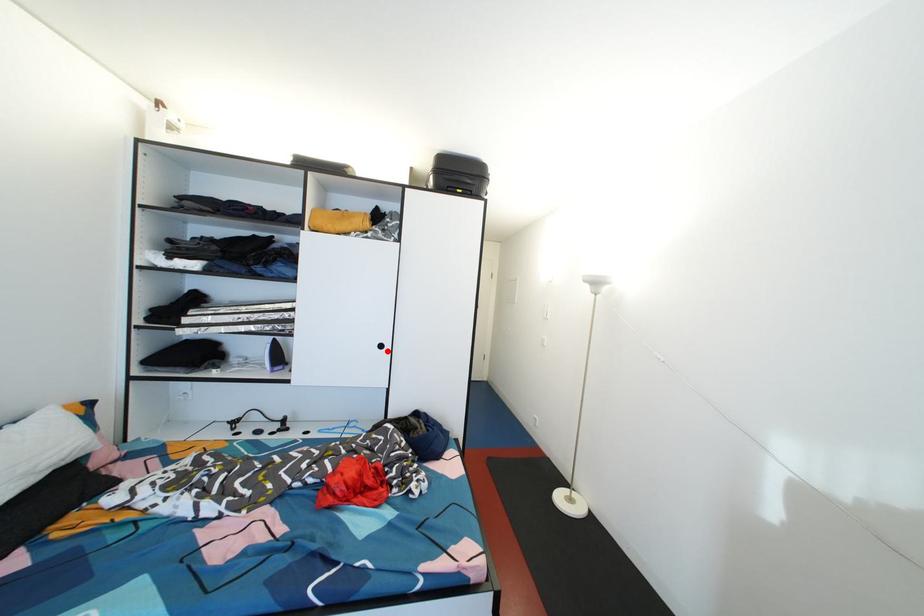
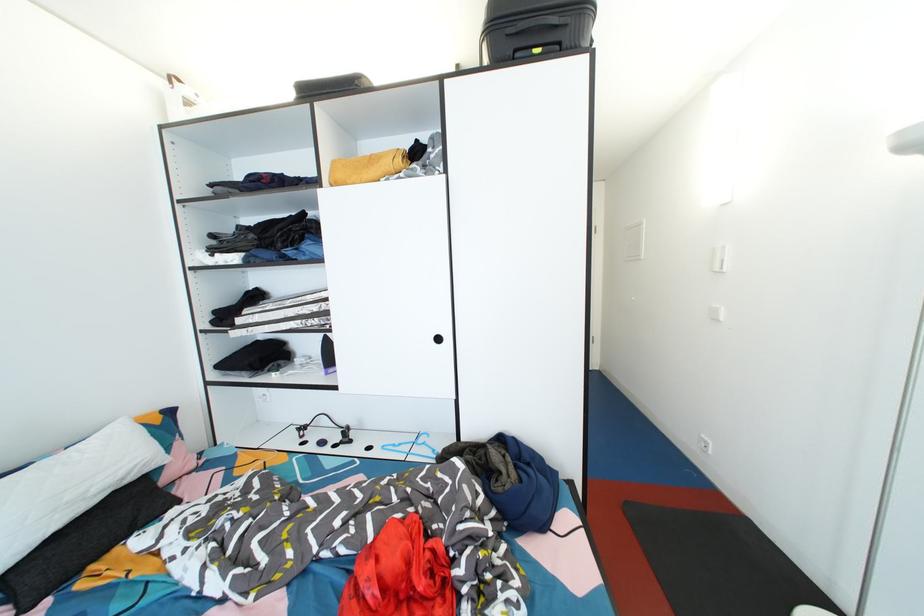
In the second image, find the point that corresponds to the highlighted location in the first image.

(444, 344)